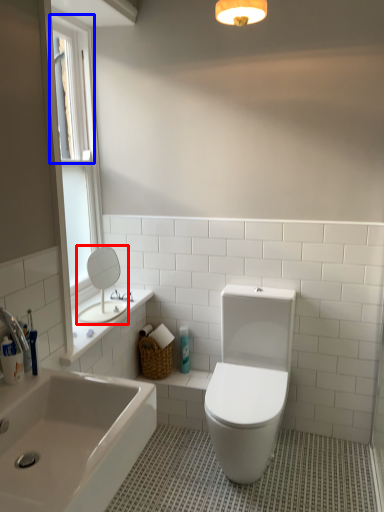
Question: Which object appears closest to the camera in this image, mirror (highlighted by a red box) or window screen (highlighted by a blue box)?

Choices:
 (A) mirror
 (B) window screen

Answer: (B)